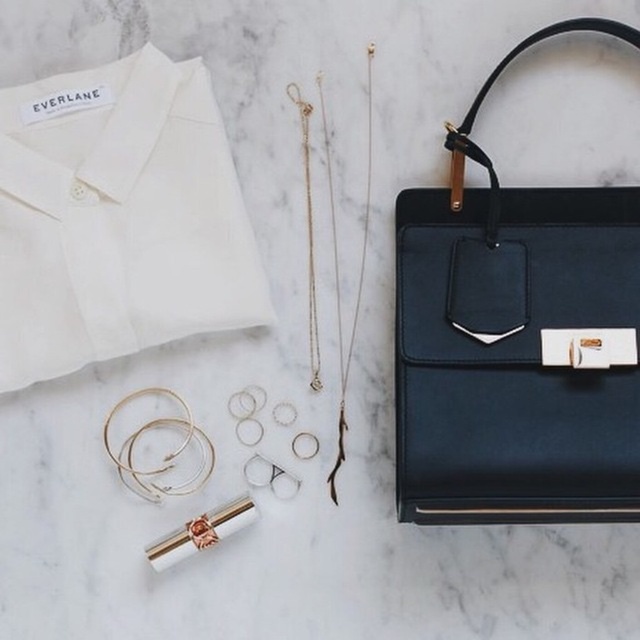
You are organizing items on a marble surface and need to retrieve the metallic gold cigarette at lower left. Can you reach it without moving the white cotton dress shirt at upper left?

The white cotton dress shirt at upper left is in front of the metallic gold cigarette at lower left, so you cannot reach the metallic gold cigarette at lower left without moving the white cotton dress shirt at upper left.

You are a delivery person placing a small package that measures 16 inches in length between the white cotton dress shirt at upper left and the metallic gold cigarette at lower left. Can the package fit in the space between them without overlapping either item?

The distance between the white cotton dress shirt at upper left and the metallic gold cigarette at lower left is 15.89 inches. Since the package is 16 inches long, it would not fit in the space between them without overlapping either item.

You are organizing a photoshoot for a fashion magazine and need to place the matte black leather handbag at right and the metallic gold cigarette at lower left in a way that highlights their size contrast. Based on their sizes, which object should be placed closer to the camera to create the illusion of being the same size in the final image?

The metallic gold cigarette at lower left should be placed closer to the camera because it is smaller in size compared to the matte black leather handbag at right. By positioning the smaller object closer, the perspective will make both appear similar in size in the photo.